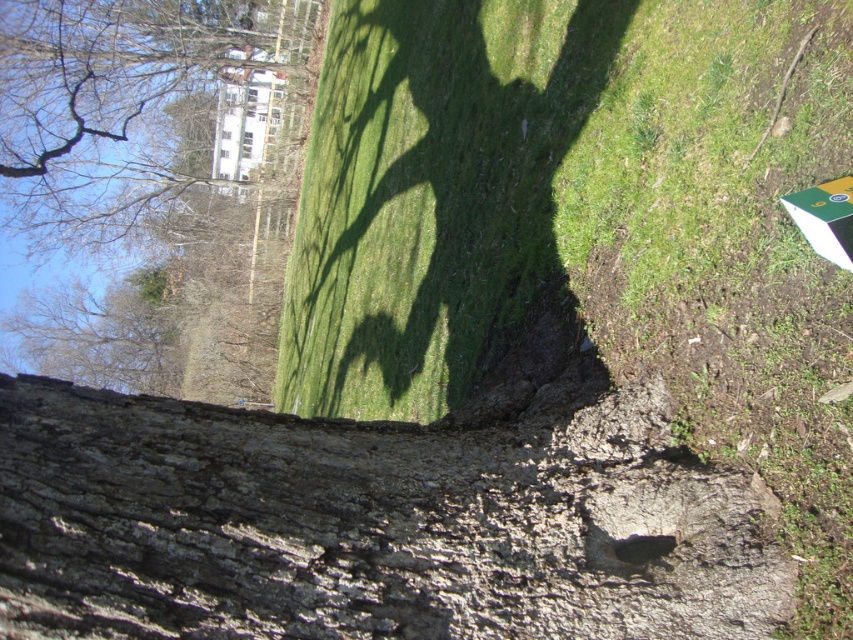
Can you confirm if rough bark tree trunk at lower center is positioned to the right of smooth bark tree at upper left?

Correct, you'll find rough bark tree trunk at lower center to the right of smooth bark tree at upper left.

Is point (49, 508) positioned behind point (299, 65)?

No, it is in front of (299, 65).

Where is `rough bark tree trunk at lower center`? The height and width of the screenshot is (640, 853). rough bark tree trunk at lower center is located at coordinates (368, 524).